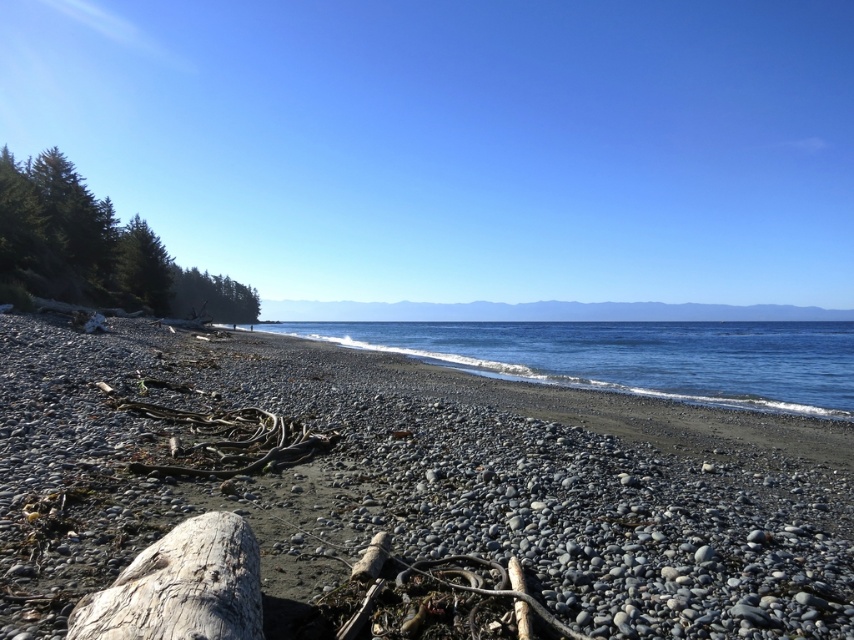
Question: Is gray pebbled beach at center further to the viewer compared to gray weathered wood log at lower left?

Choices:
 (A) no
 (B) yes

Answer: (B)

Question: Considering the real-world distances, which object is closest to the gray pebbled beach at center?

Choices:
 (A) green leafy trees at left
 (B) blue water at center
 (C) gray weathered wood log at lower left

Answer: (C)

Question: Which object appears farthest from the camera in this image?

Choices:
 (A) gray pebbled beach at center
 (B) gray weathered wood log at lower left

Answer: (A)

Question: Estimate the real-world distances between objects in this image. Which object is farther from the gray weathered wood log at lower left?

Choices:
 (A) gray pebbled beach at center
 (B) green leafy trees at left

Answer: (B)

Question: Can you confirm if blue water at center is positioned above green leafy trees at left?

Choices:
 (A) no
 (B) yes

Answer: (A)

Question: Is gray pebbled beach at center thinner than gray weathered wood log at lower left?

Choices:
 (A) yes
 (B) no

Answer: (B)